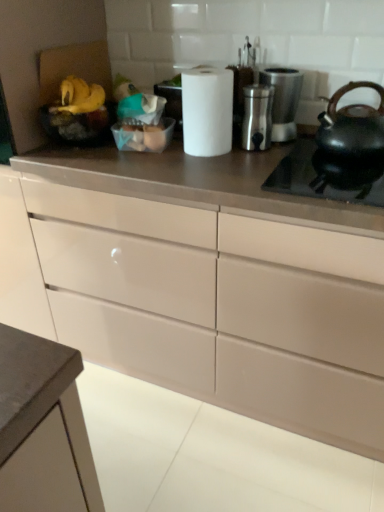
Locate an element on the screen. The image size is (384, 512). spots to the right of white matte paper towel at center is located at coordinates (273, 156).